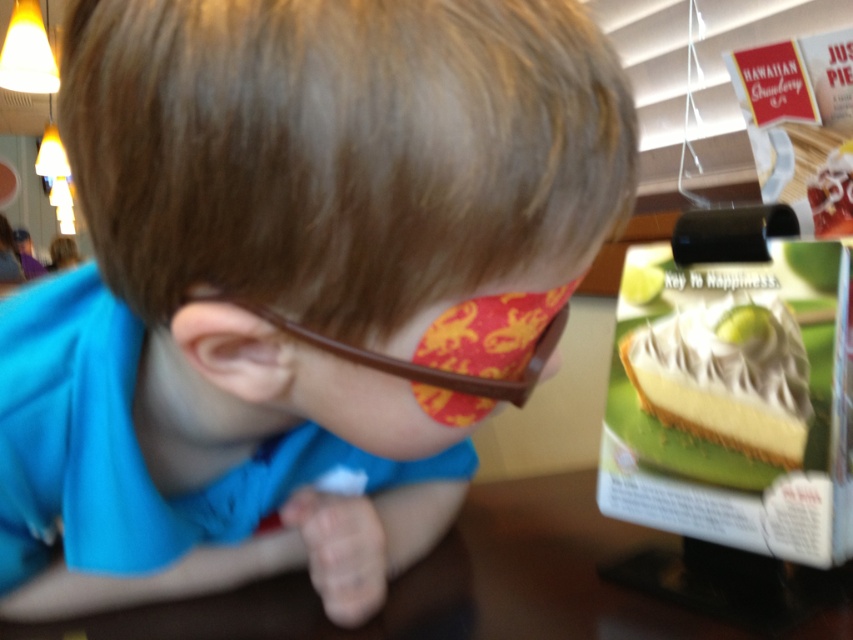
Question: Does blue fabric shirt at center have a lesser width compared to brown wooden table at lower center?

Choices:
 (A) no
 (B) yes

Answer: (B)

Question: Which object appears farthest from the camera in this image?

Choices:
 (A) white paper sign at upper center
 (B) brown plastic glasses at center

Answer: (A)

Question: Which object is the closest to the brown plastic glasses at center?

Choices:
 (A) brown wooden table at lower center
 (B) white paper sign at upper center

Answer: (A)

Question: From the image, what is the correct spatial relationship of blue fabric shirt at center in relation to brown wooden table at lower center?

Choices:
 (A) left
 (B) right

Answer: (A)

Question: Which object is closer to the camera taking this photo?

Choices:
 (A) brown plastic glasses at center
 (B) brown wooden table at lower center

Answer: (A)

Question: Does brown wooden table at lower center appear under brown plastic glasses at center?

Choices:
 (A) no
 (B) yes

Answer: (B)